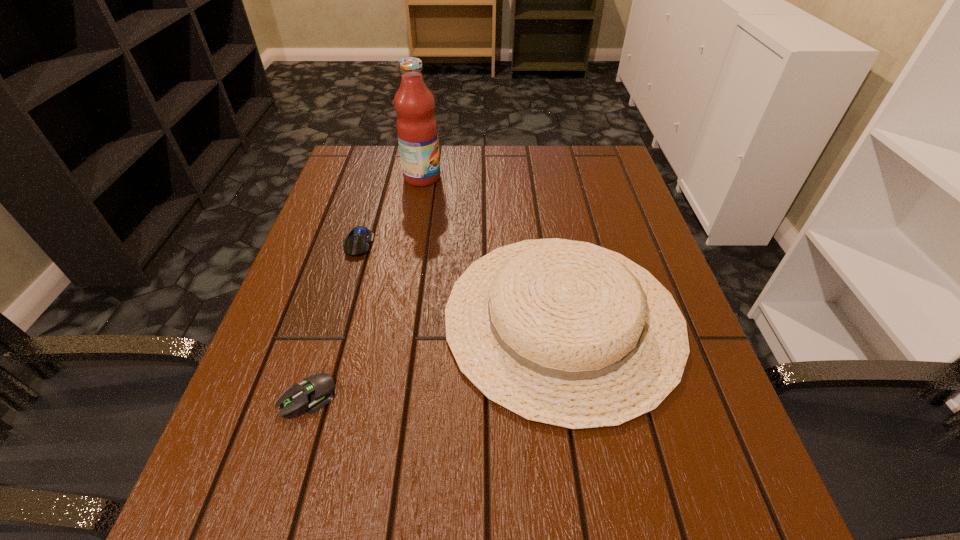
This screenshot has width=960, height=540. Identify the location of object at the far edge. pyautogui.click(x=417, y=131).

In order to click on object present at the right edge in this screenshot , I will do `click(565, 333)`.

Identify the location of vacant region at the far edge of the desktop. (473, 156).

At what (x,y) coordinates should I click in order to perform the action: click on vacant area at the near edge of the desktop. Please return your answer as a coordinate pair (x, y). The height and width of the screenshot is (540, 960). Looking at the image, I should click on (597, 504).

The height and width of the screenshot is (540, 960). I want to click on free space at the left edge of the desktop, so click(320, 215).

The image size is (960, 540). Find the location of `vacant space at the right edge`. vacant space at the right edge is located at coordinates (614, 233).

Where is `vacant area at the far left corner`? The image size is (960, 540). vacant area at the far left corner is located at coordinates (370, 146).

You are a GUI agent. You are given a task and a screenshot of the screen. Output one action in this format:
    pyautogui.click(x=<x>, y=<y>)
    Task: Click on the vacant region at the far right corner of the desktop
    This screenshot has height=540, width=960.
    Given the screenshot: What is the action you would take?
    pyautogui.click(x=613, y=152)

Locate an element on the screen. The height and width of the screenshot is (540, 960). empty space that is in between the third shortest object and the fruit juice is located at coordinates (492, 248).

I want to click on free spot between the sunhat and the nearer computer mouse, so click(436, 358).